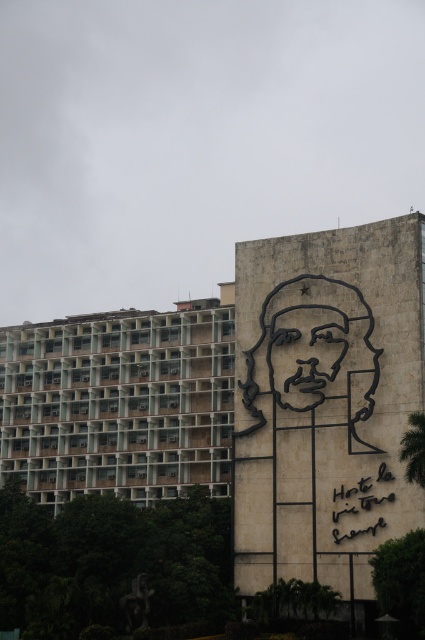
Question: Can you confirm if concrete building at left is positioned to the right of black line drawing face at center?

Choices:
 (A) no
 (B) yes

Answer: (A)

Question: Among these points, which one is farthest from the camera?

Choices:
 (A) (61, 451)
 (B) (325, 307)

Answer: (A)

Question: Which object appears closest to the camera in this image?

Choices:
 (A) black line drawing face at center
 (B) concrete building at left

Answer: (A)

Question: Which object is closer to the camera taking this photo?

Choices:
 (A) concrete building at left
 (B) black line drawing face at center

Answer: (B)

Question: In this image, where is concrete building at left located relative to black line drawing face at center?

Choices:
 (A) below
 (B) above

Answer: (A)

Question: Can you confirm if concrete building at left is wider than black line drawing face at center?

Choices:
 (A) no
 (B) yes

Answer: (B)